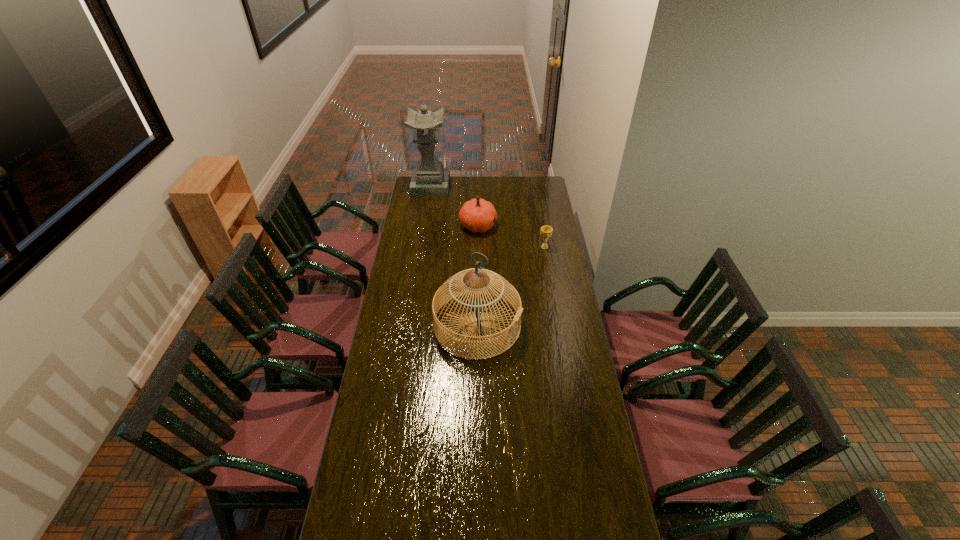
You are a GUI agent. You are given a task and a screenshot of the screen. Output one action in this format:
    pyautogui.click(x=<x>, y=<y>)
    Task: Click on the free spot located 0.250m on the front-facing side of the second farthest object
    This screenshot has height=540, width=960.
    Given the screenshot: What is the action you would take?
    pyautogui.click(x=540, y=225)

Locate an element on the screen. The image size is (960, 540). blank space located on the back of the shortest object is located at coordinates (538, 208).

At what (x,y) coordinates should I click in order to perform the action: click on object present at the far edge. Please return your answer as a coordinate pair (x, y). The image size is (960, 540). Looking at the image, I should click on (429, 179).

The height and width of the screenshot is (540, 960). I want to click on object situated at the left edge, so click(x=429, y=179).

I want to click on object that is at the right edge, so click(546, 231).

The image size is (960, 540). Find the location of `object that is positioned at the far left corner`. object that is positioned at the far left corner is located at coordinates (429, 179).

Find the location of a particular element. free space at the far edge is located at coordinates (521, 187).

Locate an element on the screen. The height and width of the screenshot is (540, 960). free region at the left edge of the desktop is located at coordinates (423, 264).

Identify the location of free region at the right edge. pos(536,221).

This screenshot has width=960, height=540. What are the coordinates of `vacant space that's between the tallest object and the third nearest object` in the screenshot? It's located at (454, 206).